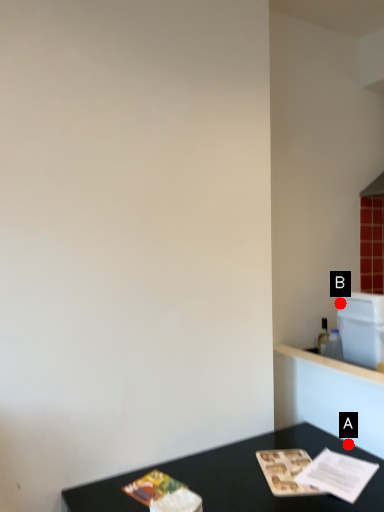
Question: Two points are circled on the image, labeled by A and B beside each circle. Which of the following is the farthest from the observer?

Choices:
 (A) A is further
 (B) B is further

Answer: (B)